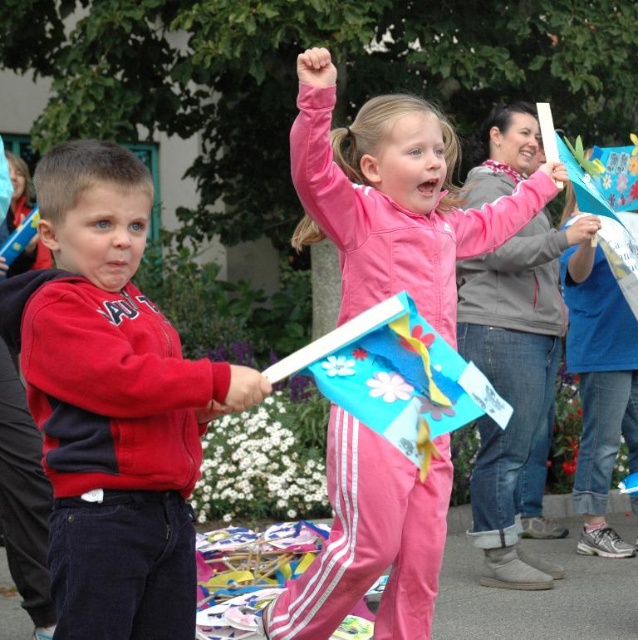
Question: Does red fleece jacket at left come in front of pink matte flag at center?

Choices:
 (A) yes
 (B) no

Answer: (A)

Question: Which point is farther to the camera?

Choices:
 (A) (389, 248)
 (B) (156, 577)

Answer: (A)

Question: Which point is closer to the camera taking this photo?

Choices:
 (A) (122, 618)
 (B) (434, 176)

Answer: (A)

Question: Can you confirm if red fleece jacket at left is bigger than pink matte flag at center?

Choices:
 (A) no
 (B) yes

Answer: (A)

Question: Can you confirm if red fleece jacket at left is positioned to the right of pink matte flag at center?

Choices:
 (A) yes
 (B) no

Answer: (B)